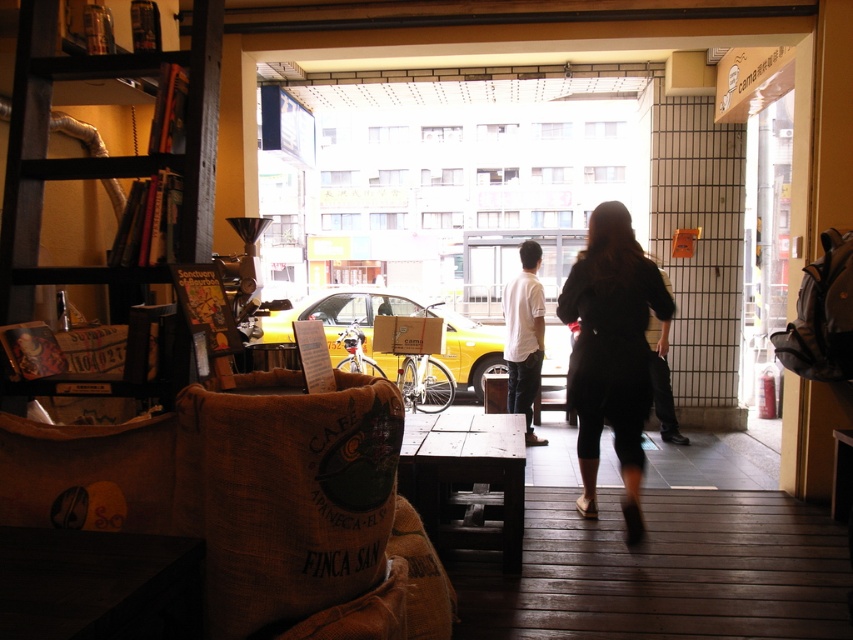
Question: Estimate the real-world distances between objects in this image. Which object is farther from the black leather pants at center?

Choices:
 (A) yellow matte taxi at center
 (B) black wood bookshelf at left
 (C) black fabric dress at center
 (D) white cotton shirt at center

Answer: (B)

Question: Is yellow matte taxi at center to the right of black leather pants at center from the viewer's perspective?

Choices:
 (A) no
 (B) yes

Answer: (A)

Question: Estimate the real-world distances between objects in this image. Which object is farther from the burlap sack at center?

Choices:
 (A) yellow matte taxi at center
 (B) black fabric dress at center

Answer: (A)

Question: From the image, what is the correct spatial relationship of white cotton shirt at center in relation to black leather pants at center?

Choices:
 (A) above
 (B) below

Answer: (A)

Question: Which of the following is the closest to the observer?

Choices:
 (A) white cotton shirt at center
 (B) black fabric dress at center

Answer: (B)

Question: Does burlap sack at center appear under white cotton shirt at center?

Choices:
 (A) yes
 (B) no

Answer: (A)